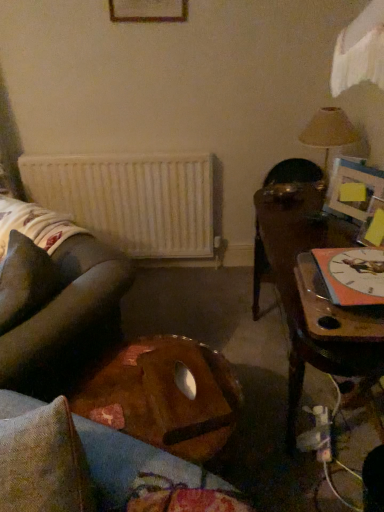
You are a GUI agent. You are given a task and a screenshot of the screen. Output one action in this format:
    pyautogui.click(x=<x>, y=<y>)
    Task: Click on the free space above wooden tray at center, arranged as the 1th table when viewed from the left (from a real-world perspective)
    
    Given the screenshot: What is the action you would take?
    pyautogui.click(x=138, y=380)